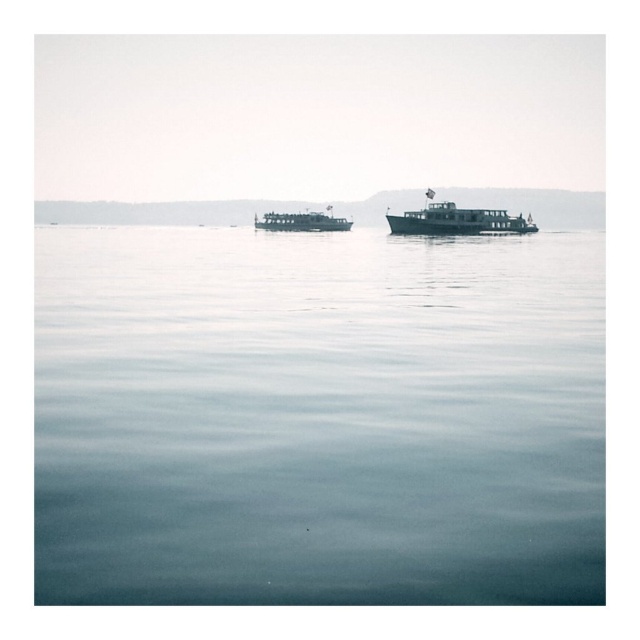
You are standing at the edge of the water and want to throw a stone to hit both point (x=500, y=220) and point (x=284, y=216). Which point should you aim for first if you want to hit them in order from closest to farthest?

You should aim for point (x=284, y=216) first because it is farther from the viewer than point (x=500, y=220), so you need to throw it after the closer one.

You are a passenger on the green matte boat at center and want to look at the clear water at center. In which direction should you look relative to your position on the boat?

The clear water at center is below the green matte boat at center, so you should look downward to see it.